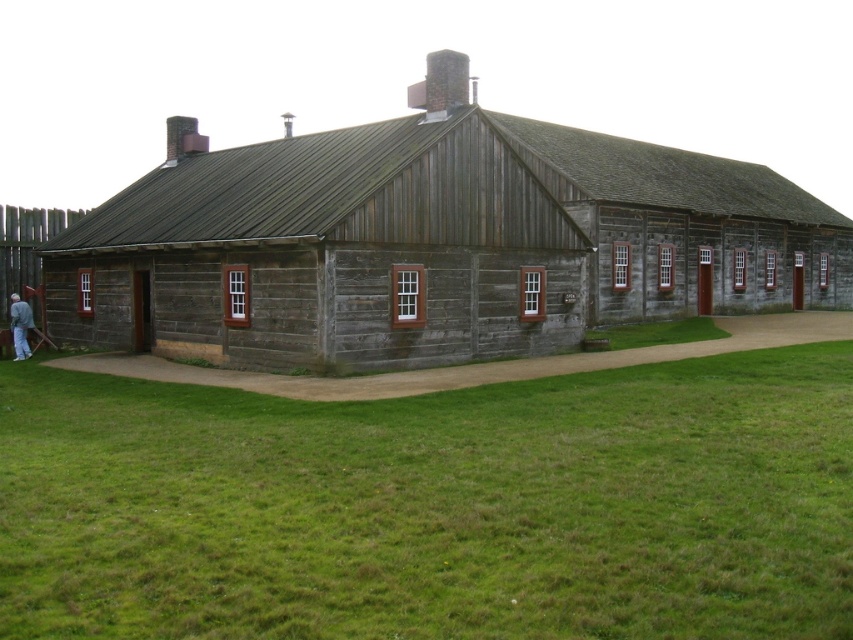
You are standing at the entrance of the wooden hut at center and want to walk to the green grass at lower center. Which direction should you head?

The green grass at lower center is to the left of the wooden hut at center, so you should head to the left to reach it.